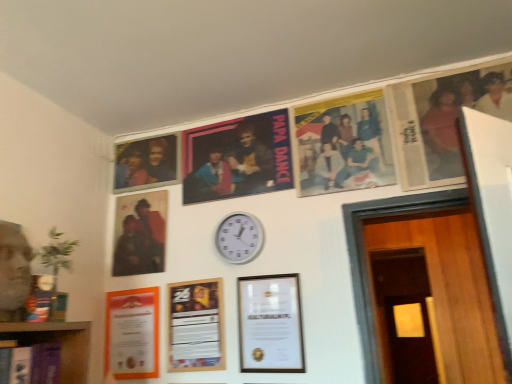
Question: Which direction should I rotate to look at matte paper poster at upper center, marked as the 1th poster in a left-to-right arrangement, — up or down?

Choices:
 (A) down
 (B) up

Answer: (B)

Question: Is matte black photo frame at center-left, which is the sixth picture frame in right-to-left order, thinner than printed paper poster at upper center, which ranks as the 2th poster in left-to-right order?

Choices:
 (A) yes
 (B) no

Answer: (B)

Question: From the image's perspective, is matte black photo frame at center-left, which is the sixth picture frame in right-to-left order, above printed paper poster at upper center, which ranks as the 2th poster in left-to-right order?

Choices:
 (A) no
 (B) yes

Answer: (A)

Question: From a real-world perspective, is matte black photo frame at center-left, which ranks as the 1th picture frame in left-to-right order, under printed paper poster at upper center, marked as the 1th poster in a right-to-left arrangement?

Choices:
 (A) no
 (B) yes

Answer: (B)

Question: Are matte black photo frame at center-left, which ranks as the 1th picture frame in left-to-right order, and printed paper poster at upper center, marked as the 1th poster in a right-to-left arrangement, located far from each other?

Choices:
 (A) yes
 (B) no

Answer: (B)

Question: Is matte black photo frame at center-left, which ranks as the 1th picture frame in left-to-right order, positioned with its back to printed paper poster at upper center, marked as the 1th poster in a right-to-left arrangement?

Choices:
 (A) no
 (B) yes

Answer: (A)

Question: Is matte black photo frame at center-left, which ranks as the 1th picture frame in left-to-right order, at the right side of printed paper poster at upper center, which ranks as the 2th poster in left-to-right order?

Choices:
 (A) yes
 (B) no

Answer: (B)

Question: Can you see wooden door at lower right touching matte paper poster at upper center, marked as the 1th poster in a left-to-right arrangement?

Choices:
 (A) yes
 (B) no

Answer: (B)

Question: Are wooden door at lower right and matte paper poster at upper center, marked as the 1th poster in a left-to-right arrangement, far apart?

Choices:
 (A) no
 (B) yes

Answer: (B)

Question: Is wooden door at lower right to the right of matte paper poster at upper center, marked as the 1th poster in a left-to-right arrangement, from the viewer's perspective?

Choices:
 (A) no
 (B) yes

Answer: (B)

Question: Considering the relative sizes of wooden door at lower right and matte paper poster at upper center, marked as the 1th poster in a left-to-right arrangement, in the image provided, is wooden door at lower right shorter than matte paper poster at upper center, marked as the 1th poster in a left-to-right arrangement,?

Choices:
 (A) yes
 (B) no

Answer: (B)

Question: Can you confirm if wooden door at lower right is taller than matte paper poster at upper center, marked as the 1th poster in a left-to-right arrangement?

Choices:
 (A) yes
 (B) no

Answer: (A)

Question: Does wooden door at lower right have a larger size compared to matte paper poster at upper center, marked as the 1th poster in a left-to-right arrangement?

Choices:
 (A) yes
 (B) no

Answer: (A)

Question: Considering the relative sizes of wooden door at lower right and printed paper poster at upper center, marked as the 1th poster in a right-to-left arrangement, in the image provided, is wooden door at lower right smaller than printed paper poster at upper center, marked as the 1th poster in a right-to-left arrangement,?

Choices:
 (A) no
 (B) yes

Answer: (A)